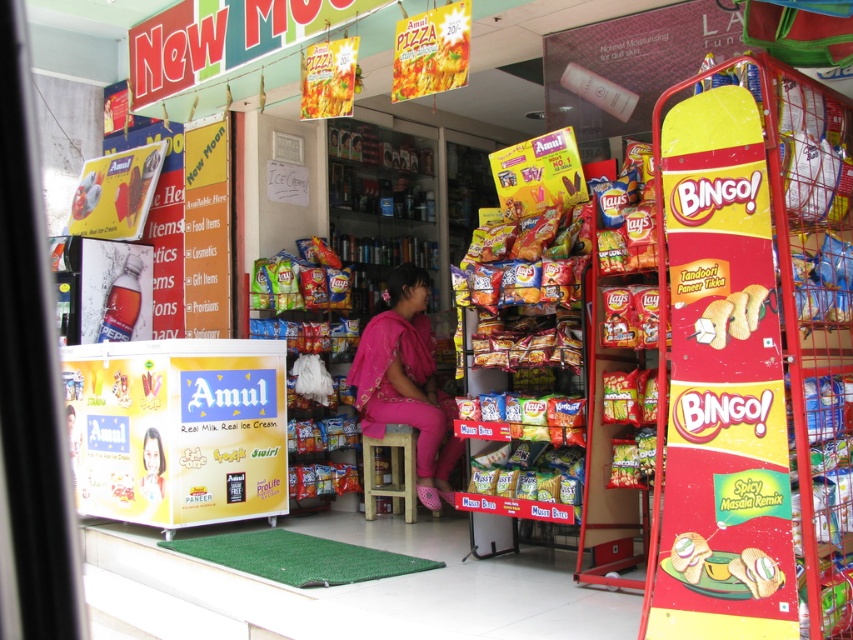
Question: Which object is the closest to the golden crispy bread at right?

Choices:
 (A) yellow matte snack at center
 (B) wooden stool at center
 (C) pink fabric dress at center
 (D) smooth pink dress at center

Answer: (A)

Question: Is golden crispy bread at right positioned before yellow matte snack at center?

Choices:
 (A) no
 (B) yes

Answer: (A)

Question: Observing the image, what is the correct spatial positioning of pink fabric dress at center in reference to wooden stool at center?

Choices:
 (A) below
 (B) above

Answer: (B)

Question: Which point is farther to the camera?

Choices:
 (A) click(358, 362)
 (B) click(693, 548)
 (C) click(154, 484)

Answer: (A)

Question: Does golden crispy bread at right come behind yellow matte snack at center?

Choices:
 (A) yes
 (B) no

Answer: (A)

Question: Which point is farther to the camera?

Choices:
 (A) smooth pink dress at center
 (B) yellow matte snack at center
 (C) wooden stool at center
 (D) pink fabric dress at center

Answer: (C)